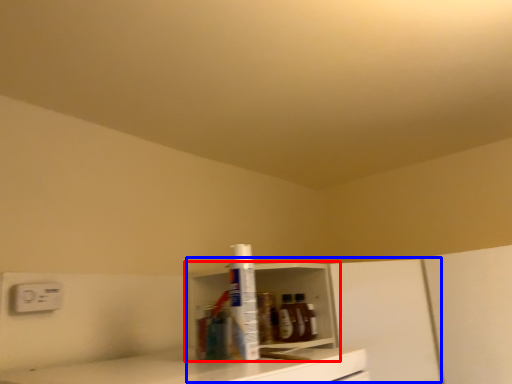
Question: Which of the following is the farthest to the observer, shelf (highlighted by a red box) or cabinetry (highlighted by a blue box)?

Choices:
 (A) shelf
 (B) cabinetry

Answer: (B)